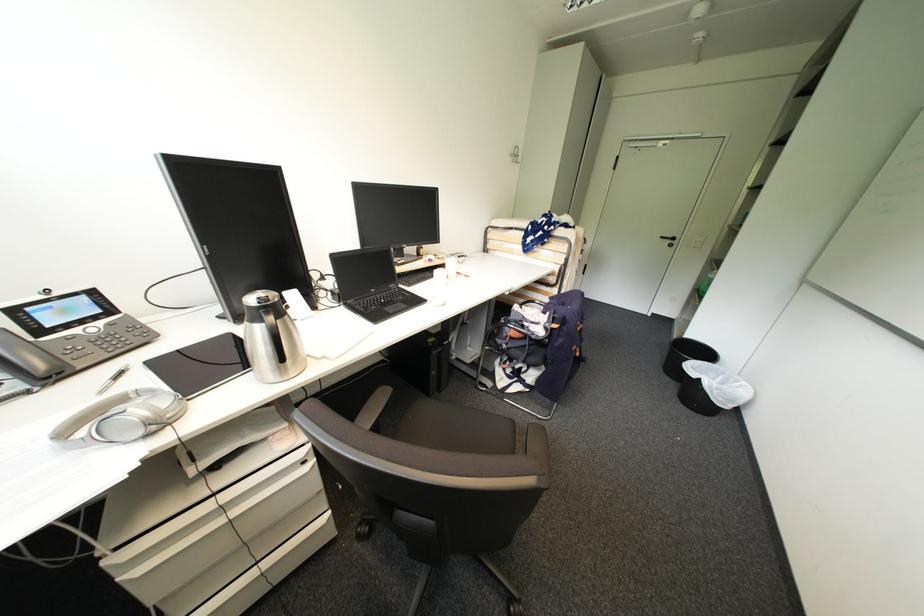
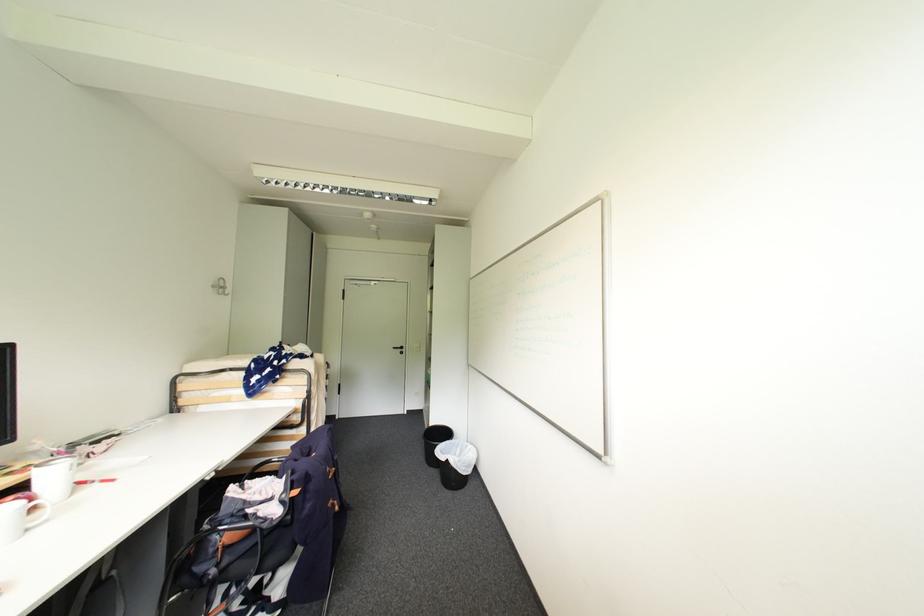
Locate, in the second image, the point that corresponds to pixel 669 238 in the first image.

(400, 349)